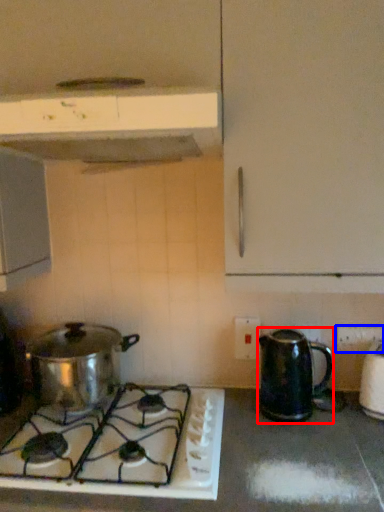
Question: Among these objects, which one is farthest to the camera, kitchen appliance (highlighted by a red box) or electric outlet (highlighted by a blue box)?

Choices:
 (A) kitchen appliance
 (B) electric outlet

Answer: (B)